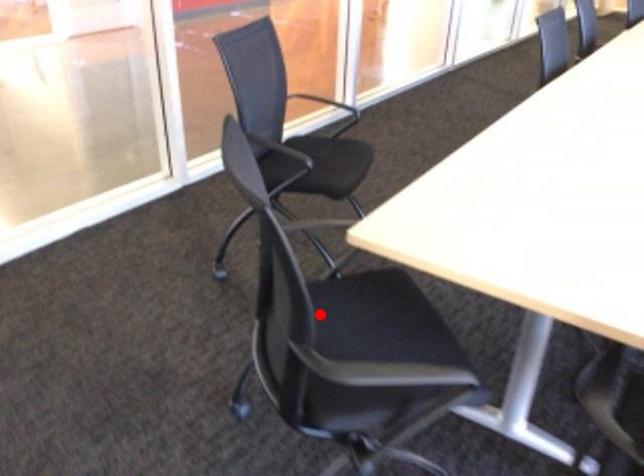
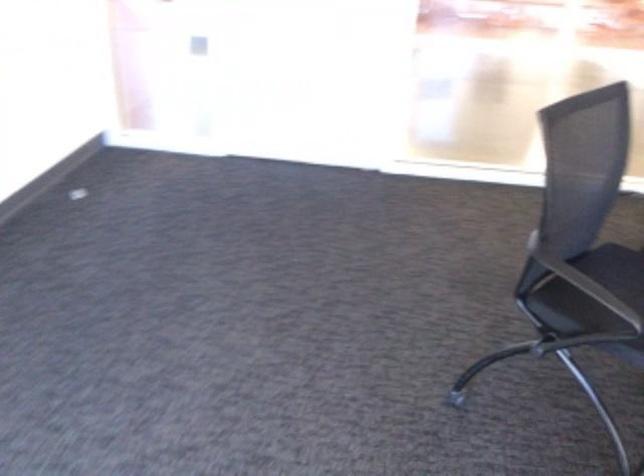
Question: I am providing you with two images of the same scene from different viewpoints. In image1, a red point is highlighted. Considering the same 3D point in image2, which of the following is correct?

Choices:
 (A) It is closer
 (B) It is farther

Answer: (B)